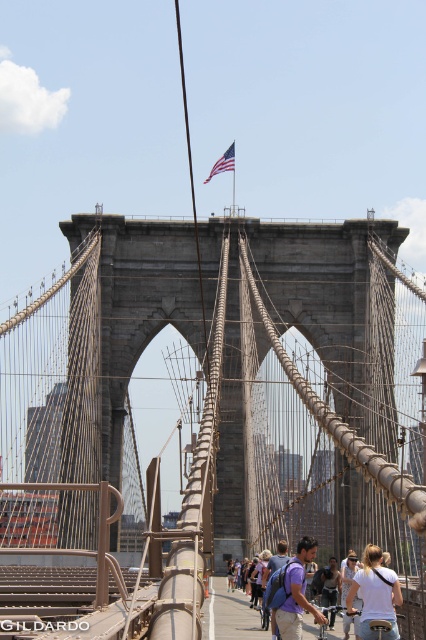
Question: Which object appears farthest from the camera in this image?

Choices:
 (A) white fabric backpack at center
 (B) matte purple backpack at center

Answer: (A)

Question: Does matte purple backpack at center appear under denim jacket at center?

Choices:
 (A) no
 (B) yes

Answer: (A)

Question: Does dark gray stone suspension bridge at center appear on the right side of matte purple backpack at center?

Choices:
 (A) yes
 (B) no

Answer: (B)

Question: Is dark gray stone suspension bridge at center in front of denim jacket at center?

Choices:
 (A) yes
 (B) no

Answer: (A)

Question: Which of the following is the closest to the observer?

Choices:
 (A) white fabric backpack at center
 (B) matte purple backpack at center
 (C) white cotton shirt at lower right
 (D) american flag at upper center

Answer: (B)

Question: Which of these objects is positioned closest to the matte purple backpack at center?

Choices:
 (A) dark gray stone suspension bridge at center
 (B) white fabric backpack at center
 (C) denim jacket at center

Answer: (B)